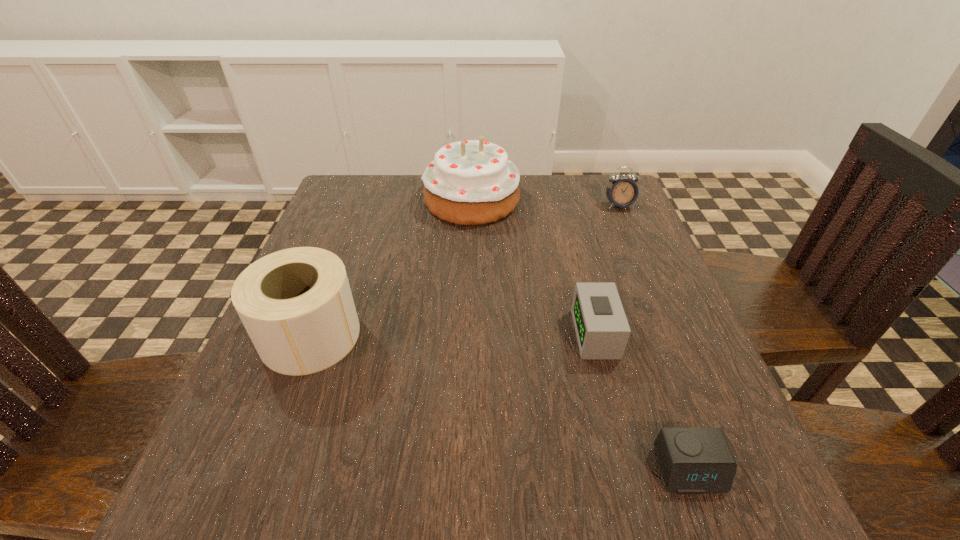
In order to click on vacant space that's between the nearest alarm clock and the fourth shortest object in this screenshot , I will do `click(500, 402)`.

In order to click on free space between the shortest object and the second shortest object in this screenshot , I will do `click(642, 402)`.

You are a GUI agent. You are given a task and a screenshot of the screen. Output one action in this format:
    pyautogui.click(x=<x>, y=<y>)
    Task: Click on the free point between the second tallest object and the farthest alarm clock
    This screenshot has width=960, height=540.
    Given the screenshot: What is the action you would take?
    pyautogui.click(x=465, y=271)

Find the location of a particular element. This screenshot has height=540, width=960. vacant region between the nearest object and the third object from right to left is located at coordinates pos(642,402).

The height and width of the screenshot is (540, 960). In order to click on free spot between the leftmost object and the nearest alarm clock in this screenshot , I will do `click(500, 402)`.

Where is `blank region between the farthest alarm clock and the leftmost object`? The width and height of the screenshot is (960, 540). blank region between the farthest alarm clock and the leftmost object is located at coordinates (465, 271).

This screenshot has width=960, height=540. In order to click on vacant area that lies between the second shortest object and the shortest object in this screenshot , I will do `click(642, 402)`.

Image resolution: width=960 pixels, height=540 pixels. I want to click on the third closest object to the tallest object, so (602, 330).

Where is `object that is the fourth closest to the leftmost alarm clock`? The width and height of the screenshot is (960, 540). object that is the fourth closest to the leftmost alarm clock is located at coordinates (296, 305).

Identify the location of alarm clock that is the second nearest to the farthest alarm clock. This screenshot has width=960, height=540. (693, 460).